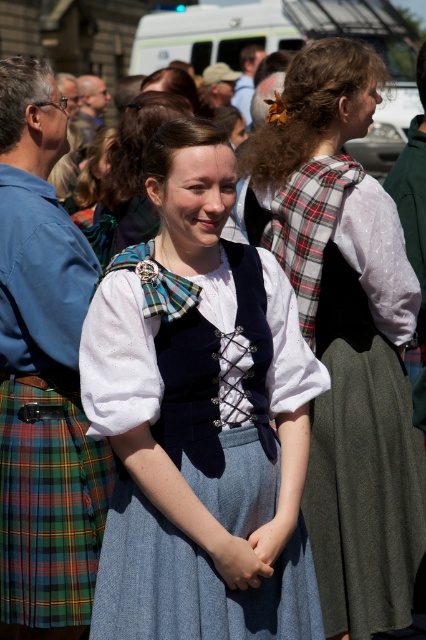
You are an attendee at this event and want to describe the outfit of the central woman. Which object is positioned to the right of the other between the plaid fabric at upper center and the matte blue dress at center?

The plaid fabric at upper center is positioned to the right of the matte blue dress at center.

You are an event planner trying to arrange a photo shoot for the attendees. You notice the plaid fabric at upper center and the matte blue dress at center. Which object is located below the other?

The plaid fabric at upper center is positioned under the matte blue dress at center, meaning it is situated below the dress.

From the picture: You are planning to take a group photo of the plaid fabric dress at center and the green plaid kilt at lower left. The photographer says the minimum distance required for a clear shot is 5 feet. Can they both fit within the frame without being too close?

The plaid fabric dress at center and green plaid kilt at lower left are 6.22 feet apart, which is more than the 5 feet minimum distance required, so they can fit within the frame without being too close.